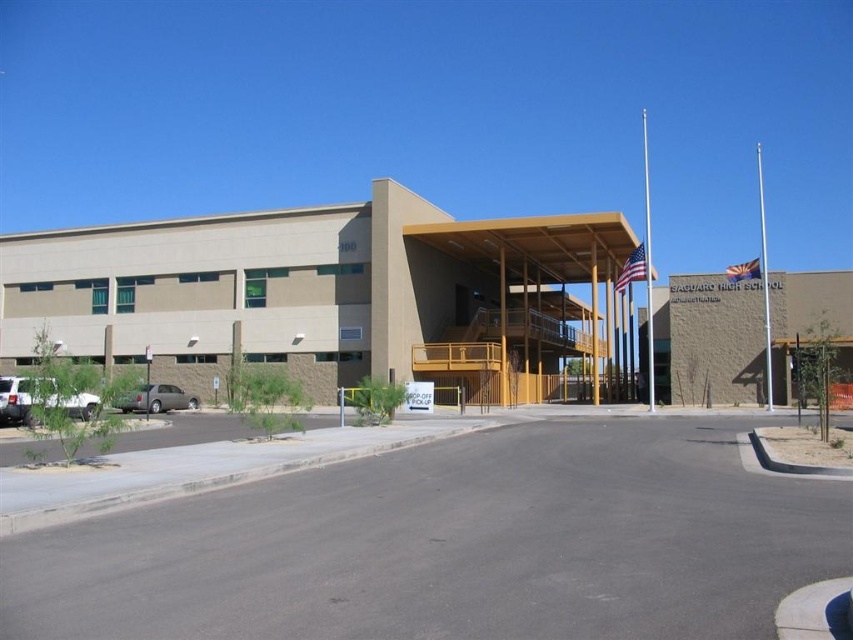
Question: Can you confirm if white matte truck at lower left is thinner than gray metallic sedan at lower left?

Choices:
 (A) no
 (B) yes

Answer: (A)

Question: Which of the following is the closest to the observer?

Choices:
 (A) gray metallic sedan at lower left
 (B) white matte truck at lower left

Answer: (B)

Question: Can you confirm if white matte truck at lower left is thinner than gray metallic sedan at lower left?

Choices:
 (A) yes
 (B) no

Answer: (B)

Question: Does white matte truck at lower left have a lesser width compared to gray metallic sedan at lower left?

Choices:
 (A) no
 (B) yes

Answer: (A)